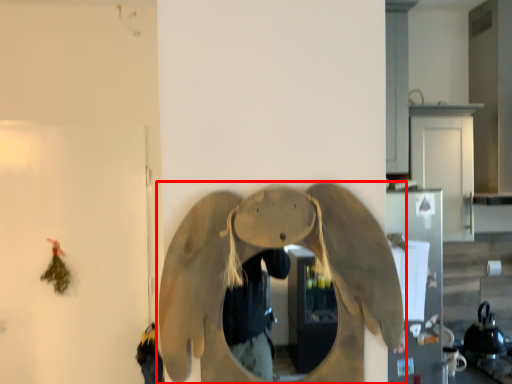
Question: Observing the image, what is the correct spatial positioning of elephant (annotated by the red box) in reference to appliance?

Choices:
 (A) left
 (B) right

Answer: (A)